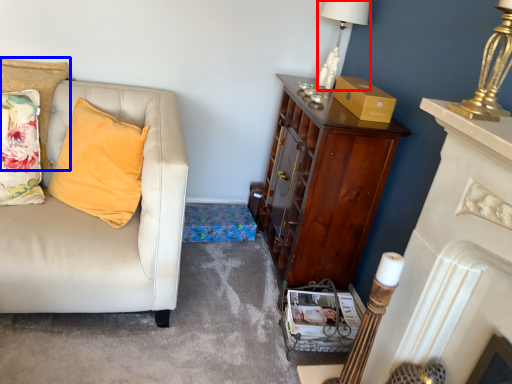
Question: Which object appears farthest to the camera in this image, lamp (highlighted by a red box) or cushion (highlighted by a blue box)?

Choices:
 (A) lamp
 (B) cushion

Answer: (A)